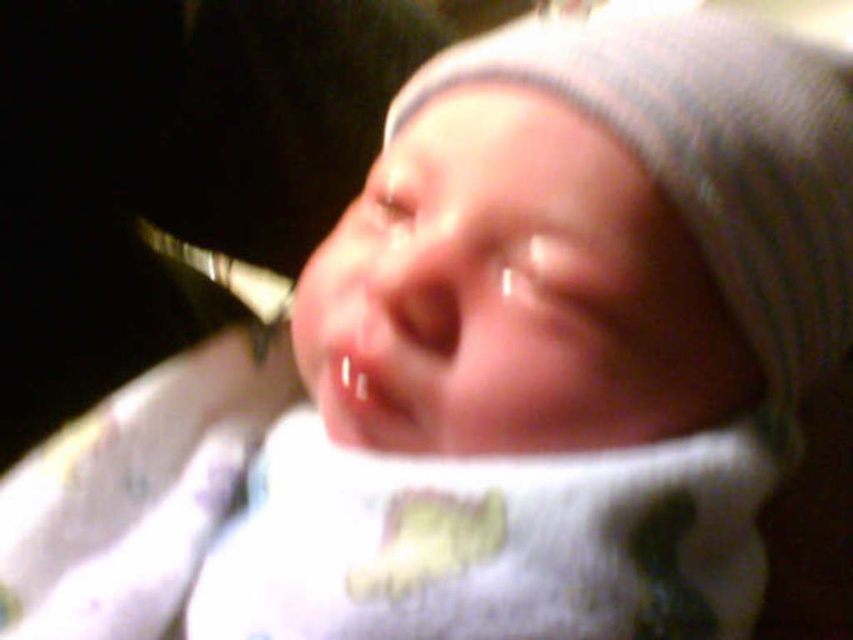
You are a photographer adjusting the lighting for a baby photo shoot. You need to ensure that the white knit hat at upper center and the smooth flesh mouth at center are both well lit. Given their positions, which object should you adjust the light to focus on first to ensure proper exposure?

The white knit hat at upper center is taller than the smooth flesh mouth at center, so you should adjust the light to focus on the white knit hat at upper center first to ensure proper exposure.

You are a photographer adjusting your camera to focus on the baby in the image. You notice two points of light reflection in the baby photo. The first point is at point (838,324) and the second is at point (383,424). Which point is closer to the camera?

Point (838,324) is further to the viewer than point (383,424), so the second point at (383,424) is closer to the camera.